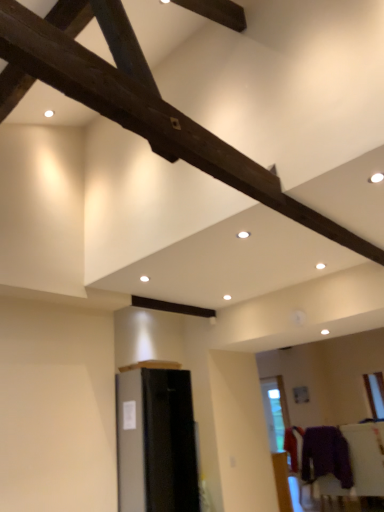
Question: Is satin black refrigerator at lower left, the 1th furniture positioned from the top, not close to purple fabric at lower right, acting as the first furniture starting from the right?

Choices:
 (A) yes
 (B) no

Answer: (A)

Question: Could purple fabric at lower right, which is the second furniture in left-to-right order, be considered to be inside satin black refrigerator at lower left, marked as the second furniture in a back-to-front arrangement?

Choices:
 (A) no
 (B) yes

Answer: (A)

Question: Is satin black refrigerator at lower left, arranged as the first furniture when viewed from the front, next to purple fabric at lower right, which is the second furniture in left-to-right order?

Choices:
 (A) no
 (B) yes

Answer: (A)

Question: Considering the relative sizes of satin black refrigerator at lower left, which is the second furniture in bottom-to-top order, and purple fabric at lower right, acting as the first furniture starting from the right, in the image provided, is satin black refrigerator at lower left, which is the second furniture in bottom-to-top order, wider than purple fabric at lower right, acting as the first furniture starting from the right,?

Choices:
 (A) no
 (B) yes

Answer: (B)

Question: From a real-world perspective, is satin black refrigerator at lower left, which is the second furniture in bottom-to-top order, physically below purple fabric at lower right, which is the second furniture in left-to-right order?

Choices:
 (A) yes
 (B) no

Answer: (B)

Question: From their relative heights in the image, would you say satin black refrigerator at lower left, which appears as the 2th furniture when viewed from the right, is taller or shorter than purple fabric at lower right, which is the second furniture in left-to-right order?

Choices:
 (A) tall
 (B) short

Answer: (A)

Question: Looking at the image, does satin black refrigerator at lower left, marked as the second furniture in a back-to-front arrangement, seem bigger or smaller compared to purple fabric at lower right, marked as the 2th furniture in a top-to-bottom arrangement?

Choices:
 (A) big
 (B) small

Answer: (A)

Question: From a real-world perspective, is satin black refrigerator at lower left, the 1th furniture positioned from the top, positioned above or below purple fabric at lower right, marked as the 2th furniture in a top-to-bottom arrangement?

Choices:
 (A) above
 (B) below

Answer: (A)

Question: Relative to purple fabric at lower right, arranged as the first furniture when ordered from the bottom, is satin black refrigerator at lower left, positioned as the 1th furniture in left-to-right order, in front or behind?

Choices:
 (A) front
 (B) behind

Answer: (A)

Question: Is purple fuzzy sweater at lower right inside the boundaries of purple fabric at lower right, which is the second furniture in left-to-right order, or outside?

Choices:
 (A) outside
 (B) inside

Answer: (A)

Question: From a real-world perspective, is purple fuzzy sweater at lower right positioned above or below purple fabric at lower right, acting as the first furniture starting from the right?

Choices:
 (A) above
 (B) below

Answer: (A)

Question: Considering the positions of purple fuzzy sweater at lower right and purple fabric at lower right, arranged as the first furniture when ordered from the bottom, in the image, is purple fuzzy sweater at lower right taller or shorter than purple fabric at lower right, arranged as the first furniture when ordered from the bottom,?

Choices:
 (A) tall
 (B) short

Answer: (B)

Question: From the image's perspective, is purple fuzzy sweater at lower right above or below purple fabric at lower right, marked as the 2th furniture in a top-to-bottom arrangement?

Choices:
 (A) below
 (B) above

Answer: (B)

Question: From the image's perspective, is purple fabric at lower right, which is the second furniture in left-to-right order, above or below satin black refrigerator at lower left, which appears as the 2th furniture when viewed from the right?

Choices:
 (A) above
 (B) below

Answer: (B)

Question: In terms of height, does purple fabric at lower right, arranged as the first furniture when ordered from the bottom, look taller or shorter compared to satin black refrigerator at lower left, which appears as the 2th furniture when viewed from the right?

Choices:
 (A) tall
 (B) short

Answer: (B)